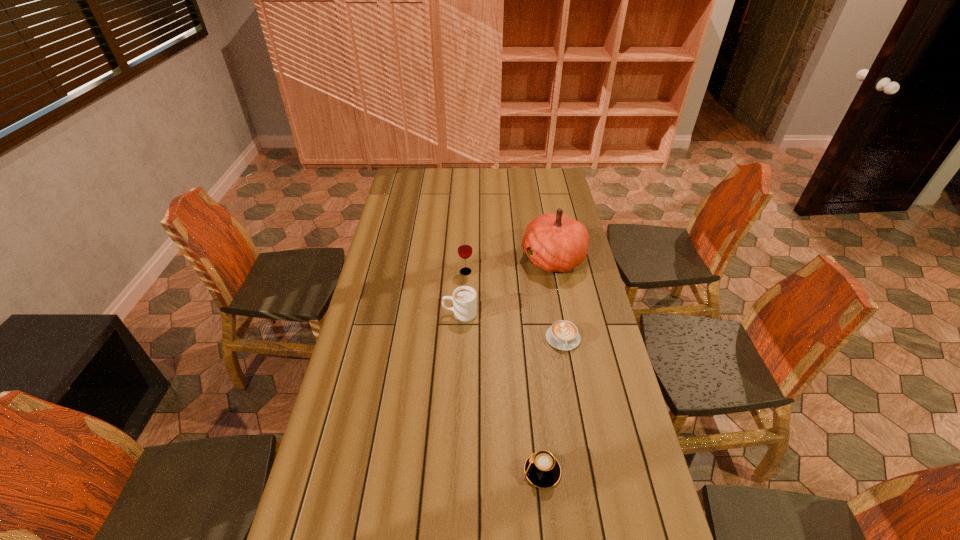
Find the location of a particular element. The image size is (960, 540). free space located 0.070m on the front-facing side of the tallest object is located at coordinates coord(504,258).

This screenshot has height=540, width=960. Identify the location of free region located 0.350m on the front of the glass. (463, 345).

Identify the location of vacant space situated 0.110m on the side with the handle of the leftmost cappuccino. (413, 314).

You are a GUI agent. You are given a task and a screenshot of the screen. Output one action in this format:
    pyautogui.click(x=<x>, y=<y>)
    Task: Click on the vacant area situated on the side with the handle of the leftmost cappuccino
    Image resolution: width=960 pixels, height=540 pixels.
    Given the screenshot: What is the action you would take?
    pyautogui.click(x=394, y=314)

At what (x,y) coordinates should I click in order to perform the action: click on vacant space located on the side with the handle of the leftmost cappuccino. Please return your answer as a coordinate pair (x, y). Looking at the image, I should click on [x=359, y=314].

This screenshot has height=540, width=960. I want to click on vacant space located 0.080m on the front of the second cappuccino from right to left, so click(x=547, y=523).

Find the location of a particular element. free space located on the side of the second farthest cappuccino with the handle is located at coordinates (583, 446).

Image resolution: width=960 pixels, height=540 pixels. In order to click on pumpkin that is at the right edge in this screenshot , I will do `click(557, 243)`.

The image size is (960, 540). I want to click on cappuccino that is at the right edge, so click(563, 335).

The width and height of the screenshot is (960, 540). In the image, there is a desktop. Find the location of `vacant space at the far edge`. vacant space at the far edge is located at coordinates (457, 188).